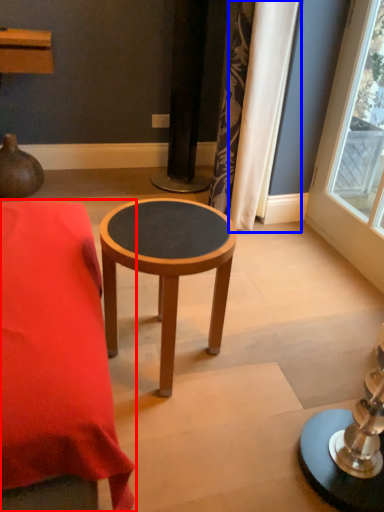
Question: Which point is closer to the camera, table (highlighted by a red box) or curtain (highlighted by a blue box)?

Choices:
 (A) table
 (B) curtain

Answer: (A)